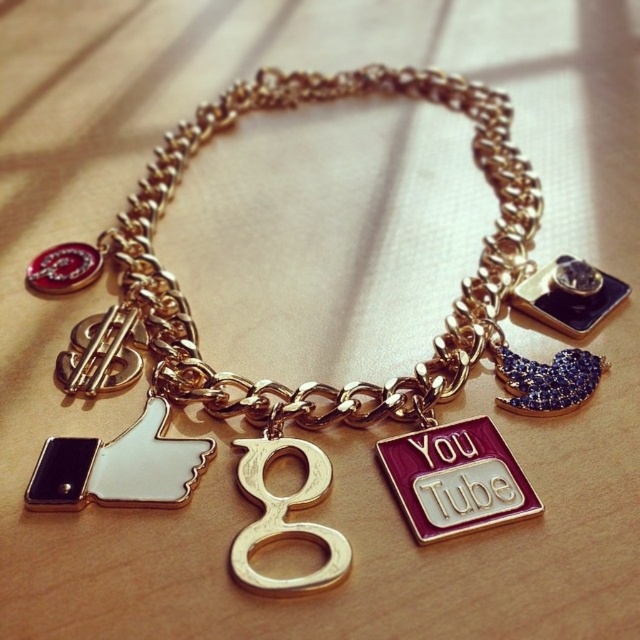
Question: Among these objects, which one is nearest to the camera?

Choices:
 (A) gold metallic letter "g" at center
 (B) white matte thumbs up at center

Answer: (A)

Question: Is white matte thumbs up at center smaller than gold metallic letter "g" at center?

Choices:
 (A) yes
 (B) no

Answer: (A)

Question: Observing the image, what is the correct spatial positioning of white matte thumbs up at center in reference to gold metallic letter "g" at center?

Choices:
 (A) right
 (B) left

Answer: (B)

Question: Can you confirm if white matte thumbs up at center is positioned above gold metallic letter "g" at center?

Choices:
 (A) no
 (B) yes

Answer: (B)

Question: Which point is farther from the camera taking this photo?

Choices:
 (A) (317, 586)
 (B) (145, 416)

Answer: (B)

Question: Which point is farther to the camera?

Choices:
 (A) (168, 410)
 (B) (342, 548)

Answer: (A)